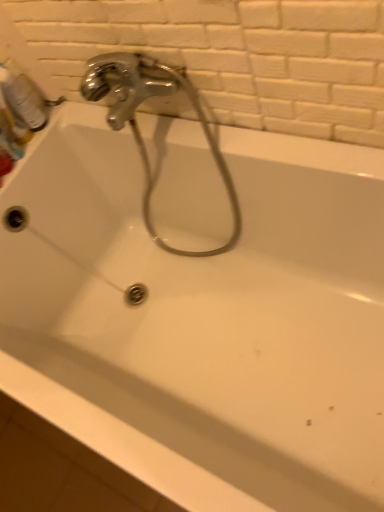
Question: In terms of width, does translucent plastic mouthwash at upper left look wider or thinner when compared to chrome metallic faucet at upper left?

Choices:
 (A) thin
 (B) wide

Answer: (A)

Question: Is translucent plastic mouthwash at upper left bigger or smaller than chrome metallic faucet at upper left?

Choices:
 (A) big
 (B) small

Answer: (B)

Question: From a real-world perspective, is translucent plastic mouthwash at upper left physically located above or below chrome metallic faucet at upper left?

Choices:
 (A) below
 (B) above

Answer: (B)

Question: In the image, is chrome metallic faucet at upper left positioned in front of or behind translucent plastic mouthwash at upper left?

Choices:
 (A) front
 (B) behind

Answer: (A)

Question: Considering the positions of chrome metallic faucet at upper left and translucent plastic mouthwash at upper left in the image, is chrome metallic faucet at upper left bigger or smaller than translucent plastic mouthwash at upper left?

Choices:
 (A) small
 (B) big

Answer: (B)

Question: From a real-world perspective, is chrome metallic faucet at upper left above or below translucent plastic mouthwash at upper left?

Choices:
 (A) below
 (B) above

Answer: (A)

Question: Visually, is chrome metallic faucet at upper left positioned to the left or to the right of translucent plastic mouthwash at upper left?

Choices:
 (A) left
 (B) right

Answer: (B)